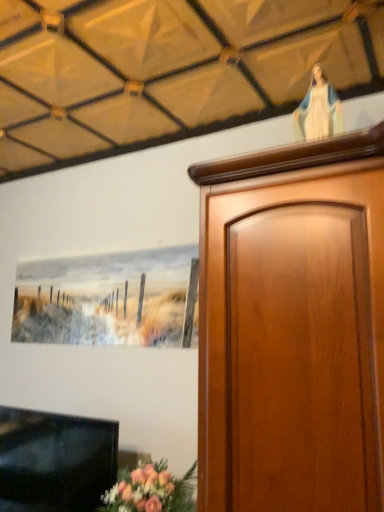
Question: From a real-world perspective, is white glossy statue at upper right over black glossy tv at lower left?

Choices:
 (A) no
 (B) yes

Answer: (B)

Question: Considering the relative sizes of white glossy statue at upper right and black glossy tv at lower left in the image provided, is white glossy statue at upper right taller than black glossy tv at lower left?

Choices:
 (A) yes
 (B) no

Answer: (B)

Question: Does white glossy statue at upper right appear on the right side of black glossy tv at lower left?

Choices:
 (A) yes
 (B) no

Answer: (A)

Question: From a real-world perspective, is white glossy statue at upper right located beneath black glossy tv at lower left?

Choices:
 (A) no
 (B) yes

Answer: (A)

Question: Is there a large distance between white glossy statue at upper right and black glossy tv at lower left?

Choices:
 (A) no
 (B) yes

Answer: (B)

Question: Is the position of white glossy statue at upper right more distant than that of black glossy tv at lower left?

Choices:
 (A) no
 (B) yes

Answer: (A)

Question: Is black glossy tv at lower left not within white glossy statue at upper right?

Choices:
 (A) no
 (B) yes

Answer: (B)

Question: From a real-world perspective, is black glossy tv at lower left beneath white glossy statue at upper right?

Choices:
 (A) no
 (B) yes

Answer: (B)

Question: Does black glossy tv at lower left have a smaller size compared to white glossy statue at upper right?

Choices:
 (A) no
 (B) yes

Answer: (A)

Question: Is black glossy tv at lower left not near white glossy statue at upper right?

Choices:
 (A) no
 (B) yes

Answer: (B)

Question: Is the depth of black glossy tv at lower left less than that of white glossy statue at upper right?

Choices:
 (A) no
 (B) yes

Answer: (A)

Question: Considering the relative positions of black glossy tv at lower left and white glossy statue at upper right in the image provided, is black glossy tv at lower left to the right of white glossy statue at upper right from the viewer's perspective?

Choices:
 (A) no
 (B) yes

Answer: (A)

Question: Based on their positions, is white glossy statue at upper right located to the left or right of black glossy tv at lower left?

Choices:
 (A) right
 (B) left

Answer: (A)